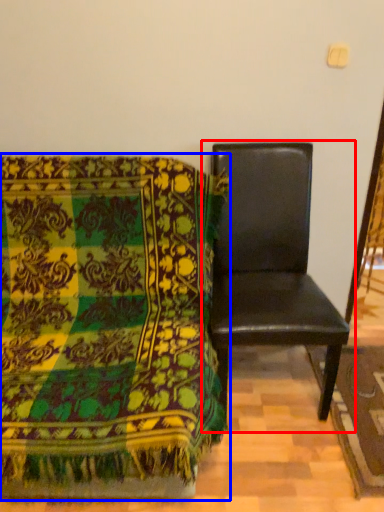
Question: Which point is closer to the camera, chair (highlighted by a red box) or chair (highlighted by a blue box)?

Choices:
 (A) chair
 (B) chair

Answer: (B)